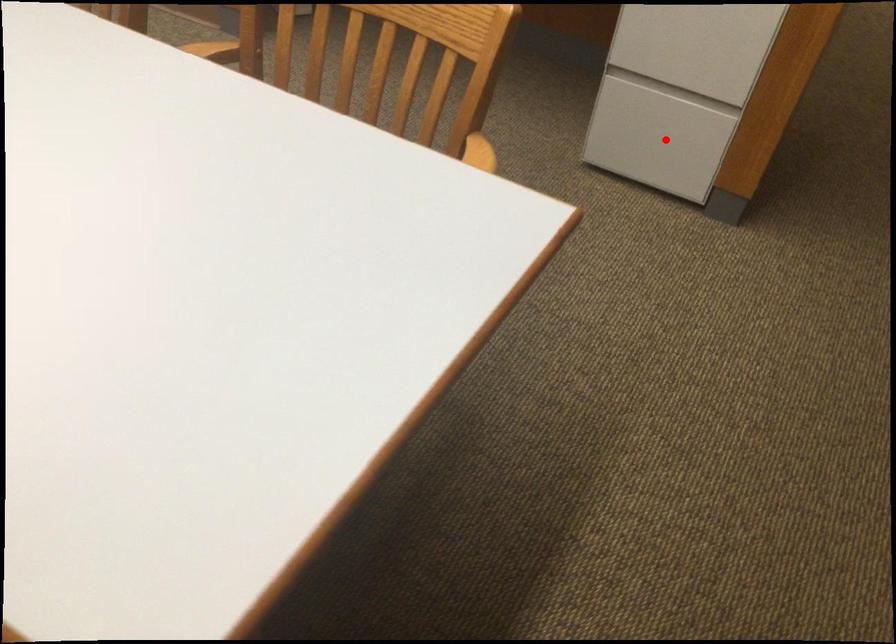
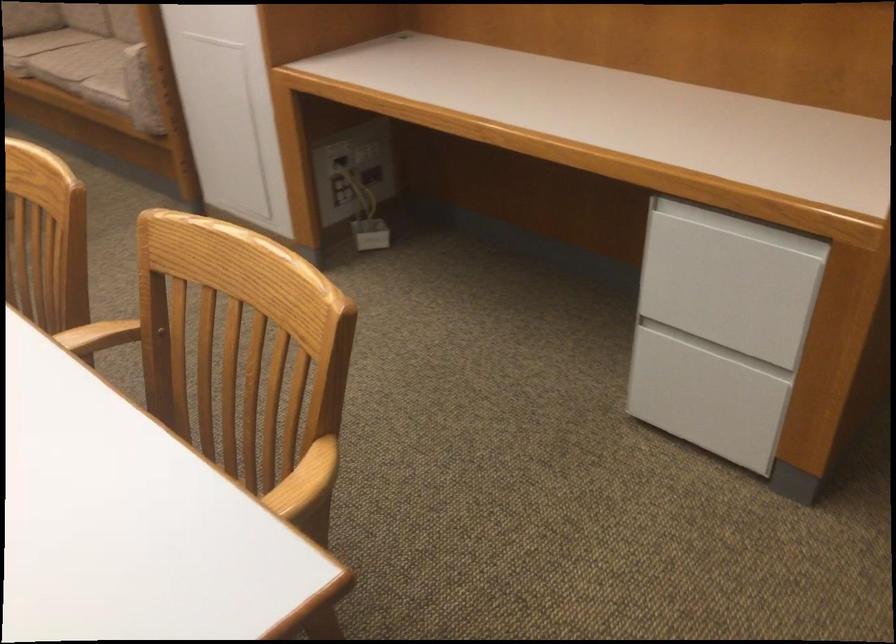
Question: I am providing you with two images of the same scene from different viewpoints. A red point is shown in image1. For the corresponding object point in image2, is it positioned nearer or farther from the camera?

Choices:
 (A) Nearer
 (B) Farther

Answer: (A)